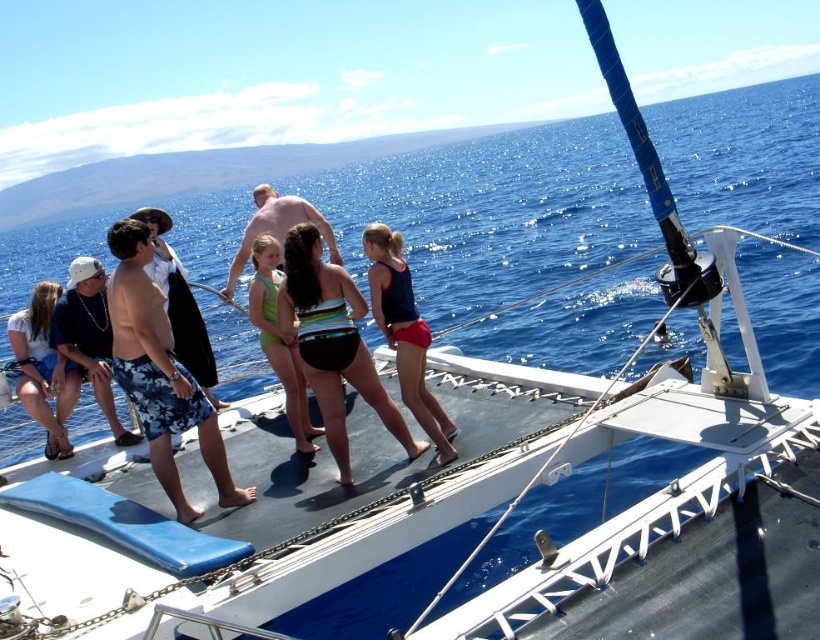
Is matte black shorts at left in front of pink skin at center?

No, it is not.

Is matte black shorts at left thinner than pink skin at center?

Indeed, matte black shorts at left has a lesser width compared to pink skin at center.

Which is in front, point (44, 285) or point (244, 236)?

Positioned in front is point (44, 285).

Identify the location of matte black shorts at left. This screenshot has width=820, height=640. (43, 369).

Who is taller, matte blue swimsuit at center or green swimsuit at center?

green swimsuit at center

Which is above, matte blue swimsuit at center or green swimsuit at center?

green swimsuit at center is above.

Between point (393, 316) and point (257, 236), which one is positioned in front?

Point (393, 316) is in front.

Locate an element on the screen. matte blue swimsuit at center is located at coordinates (404, 333).

Which is behind, point (217, 451) or point (274, 291)?

The point (274, 291) is more distant.

Which of these two, camouflage shorts at left or green swimsuit at center, stands shorter?

green swimsuit at center is shorter.

The width and height of the screenshot is (820, 640). What do you see at coordinates (160, 372) in the screenshot?
I see `camouflage shorts at left` at bounding box center [160, 372].

This screenshot has width=820, height=640. Find the location of `camouflage shorts at left`. camouflage shorts at left is located at coordinates (160, 372).